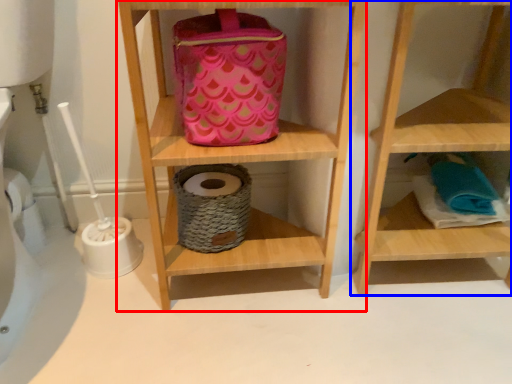
Question: Which of the following is the farthest to the observer, shelf (highlighted by a red box) or shelf (highlighted by a blue box)?

Choices:
 (A) shelf
 (B) shelf

Answer: (B)